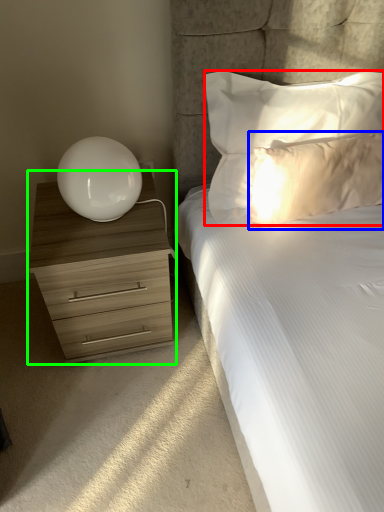
Question: Which object is the closest to the pillow (highlighted by a red box)? Choose among these: pillow (highlighted by a blue box) or chest of drawers (highlighted by a green box).

Choices:
 (A) pillow
 (B) chest of drawers

Answer: (A)